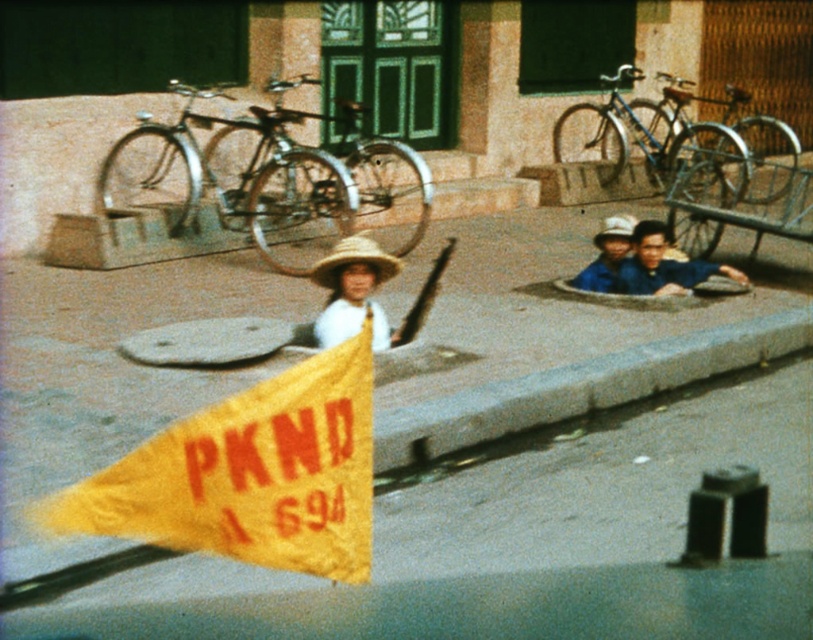
Question: Is yellow fabric flag at lower left in front of natural straw hat at center?

Choices:
 (A) yes
 (B) no

Answer: (A)

Question: Which point is closer to the camera?

Choices:
 (A) (609, 234)
 (B) (264, 449)
 (C) (341, 280)
 (D) (609, 221)

Answer: (B)

Question: Does yellow fabric flag at center have a lesser width compared to natural straw hat at center?

Choices:
 (A) no
 (B) yes

Answer: (B)

Question: Among these points, which one is nearest to the camera?

Choices:
 (A) (364, 237)
 (B) (750, 323)
 (C) (612, 227)

Answer: (A)

Question: Can you confirm if gray concrete curb at lower center is wider than matte straw hat at center?

Choices:
 (A) yes
 (B) no

Answer: (A)

Question: Which object is closer to the camera taking this photo?

Choices:
 (A) yellow fabric flag at center
 (B) gray concrete curb at lower center

Answer: (A)